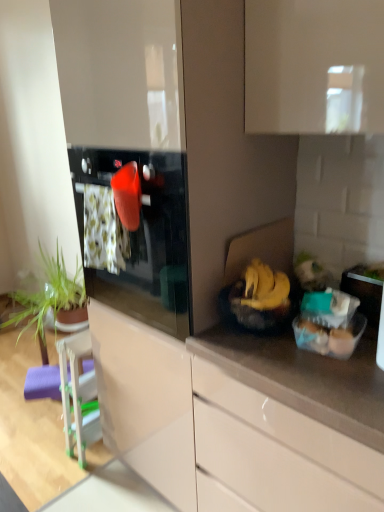
Question: Is green leafy plant at left a part of glossy black oven at center?

Choices:
 (A) yes
 (B) no

Answer: (B)

Question: Is glossy black oven at center aimed at green leafy plant at left?

Choices:
 (A) no
 (B) yes

Answer: (A)

Question: Does glossy black oven at center have a greater width compared to green leafy plant at left?

Choices:
 (A) yes
 (B) no

Answer: (A)

Question: Is glossy black oven at center not within green leafy plant at left?

Choices:
 (A) no
 (B) yes

Answer: (B)

Question: Is glossy black oven at center at the left side of green leafy plant at left?

Choices:
 (A) no
 (B) yes

Answer: (A)

Question: Is green leafy plant at left in front of or behind glossy white cabinet at lower center in the image?

Choices:
 (A) front
 (B) behind

Answer: (B)

Question: Is green leafy plant at left to the left or to the right of glossy white cabinet at lower center in the image?

Choices:
 (A) right
 (B) left

Answer: (B)

Question: Considering the positions of point (69, 301) and point (243, 437), is point (69, 301) closer or farther from the camera than point (243, 437)?

Choices:
 (A) farther
 (B) closer

Answer: (A)

Question: Choose the correct answer: Is green leafy plant at left inside glossy white cabinet at lower center or outside it?

Choices:
 (A) outside
 (B) inside

Answer: (A)

Question: Do you think purple foam bar stool at lower left is within yellow matte bananas at right, or outside of it?

Choices:
 (A) outside
 (B) inside

Answer: (A)

Question: Does point (28, 372) appear closer or farther from the camera than point (261, 286)?

Choices:
 (A) closer
 (B) farther

Answer: (B)

Question: From the image's perspective, relative to yellow matte bananas at right, is purple foam bar stool at lower left above or below?

Choices:
 (A) below
 (B) above

Answer: (A)

Question: From a real-world perspective, is purple foam bar stool at lower left above or below yellow matte bananas at right?

Choices:
 (A) below
 (B) above

Answer: (A)

Question: Based on their positions, is glossy white cabinet at lower center located to the left or right of yellow matte bananas at right?

Choices:
 (A) right
 (B) left

Answer: (A)

Question: From the image's perspective, is glossy white cabinet at lower center positioned above or below yellow matte bananas at right?

Choices:
 (A) below
 (B) above

Answer: (A)